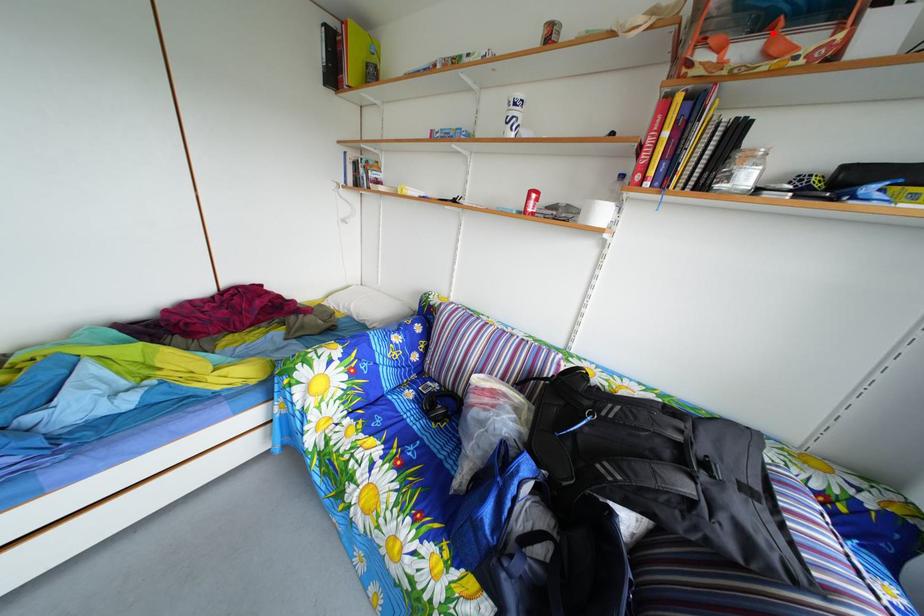
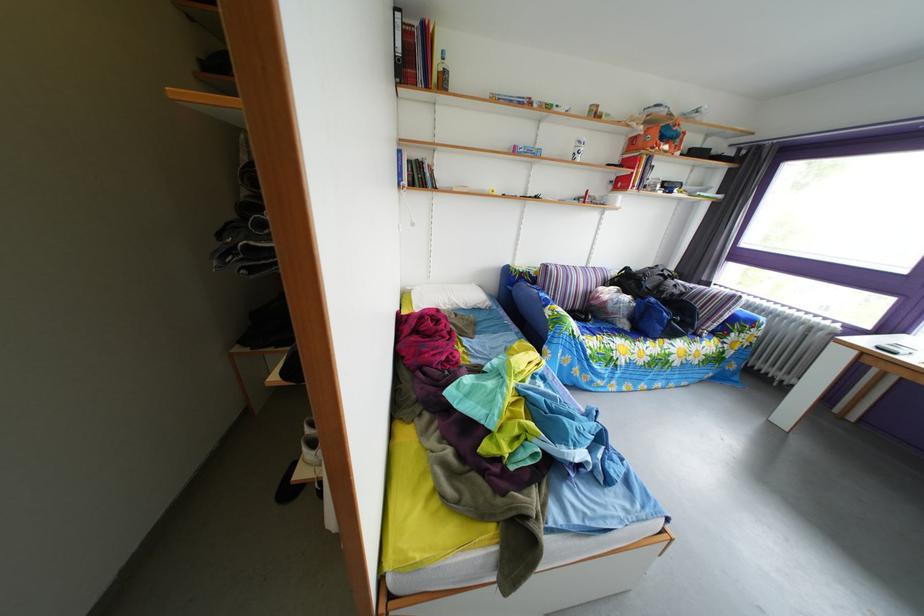
The point at the highlighted location is marked in the first image. Where is the corresponding point in the second image?

(673, 147)